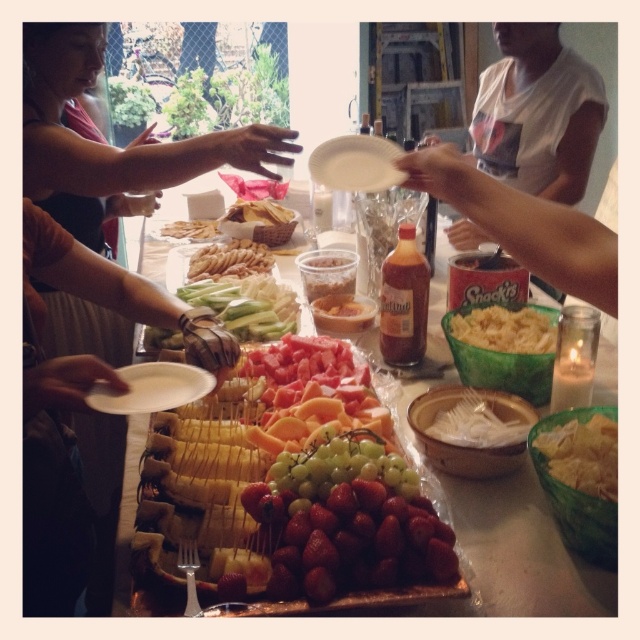
Is point (520, 496) closer to viewer compared to point (579, 276)?

No, (520, 496) is behind (579, 276).

Where is `shiny plastic tray at center`? The height and width of the screenshot is (640, 640). shiny plastic tray at center is located at coordinates 524,552.

Does point (513, 506) lie in front of point (600, 300)?

No.

I want to click on shiny plastic tray at center, so click(524, 552).

Can you confirm if green matte bowl of pasta at center is taller than golden crispy crackers at center?

In fact, green matte bowl of pasta at center may be shorter than golden crispy crackers at center.

Can you confirm if green matte bowl of pasta at center is wider than golden crispy crackers at center?

No.

Which is in front, point (518, 328) or point (248, 200)?

Point (518, 328)

Find the location of `green matte bowl of pasta at center`. green matte bowl of pasta at center is located at coordinates (504, 328).

Is point (497, 548) less distant than point (538, 321)?

Yes, it is.

The height and width of the screenshot is (640, 640). I want to click on shiny plastic tray at center, so click(x=524, y=552).

Who is more distant from viewer, [541,541] or [515,337]?

The point [515,337] is more distant.

At what (x,y) coordinates should I click in order to perform the action: click on shiny plastic tray at center. Please return your answer as a coordinate pair (x, y). The height and width of the screenshot is (640, 640). Looking at the image, I should click on (524, 552).